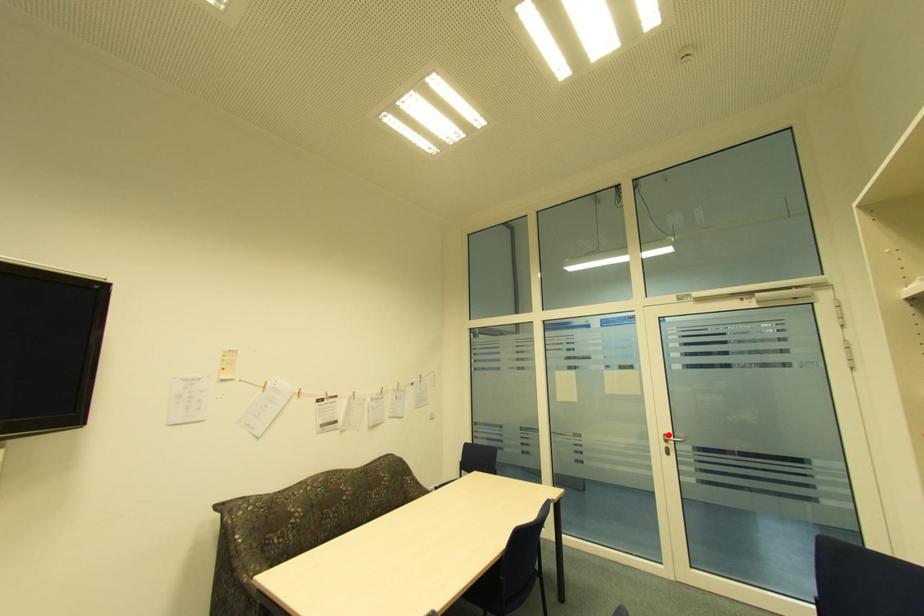
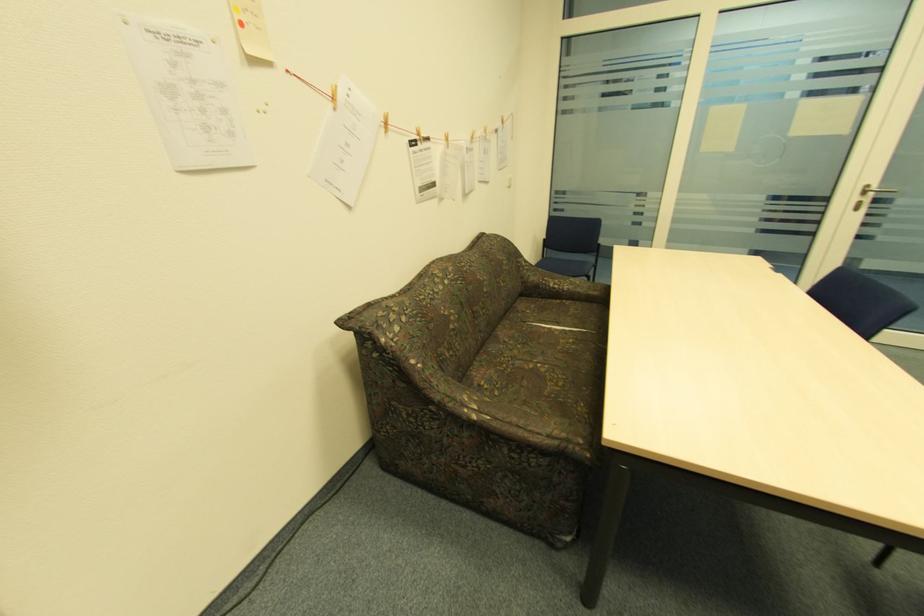
Question: I am providing you with two images of the same scene from different viewpoints. In image1, a red point is highlighted. Considering the same 3D point in image2, which of the following is correct?

Choices:
 (A) It is closer
 (B) It is farther

Answer: (B)